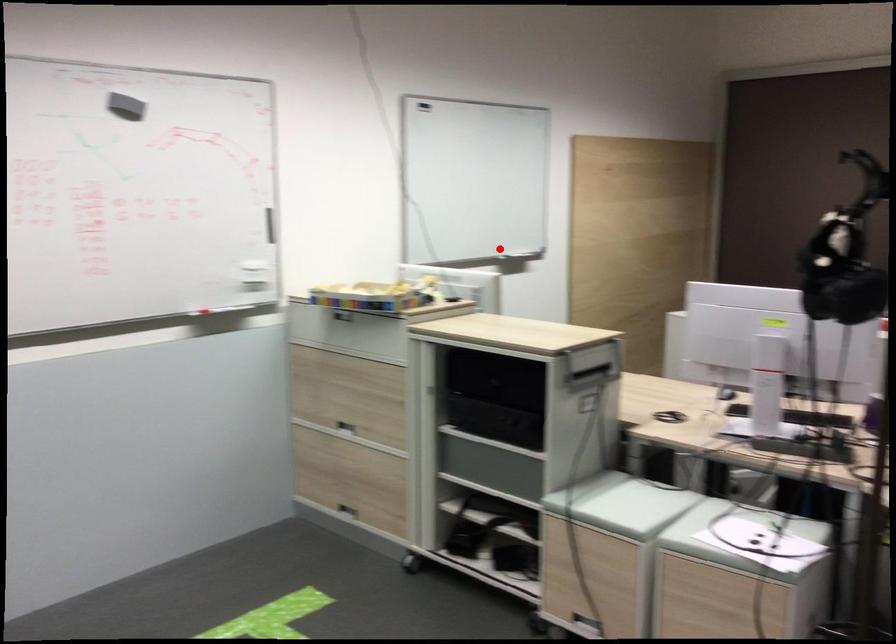
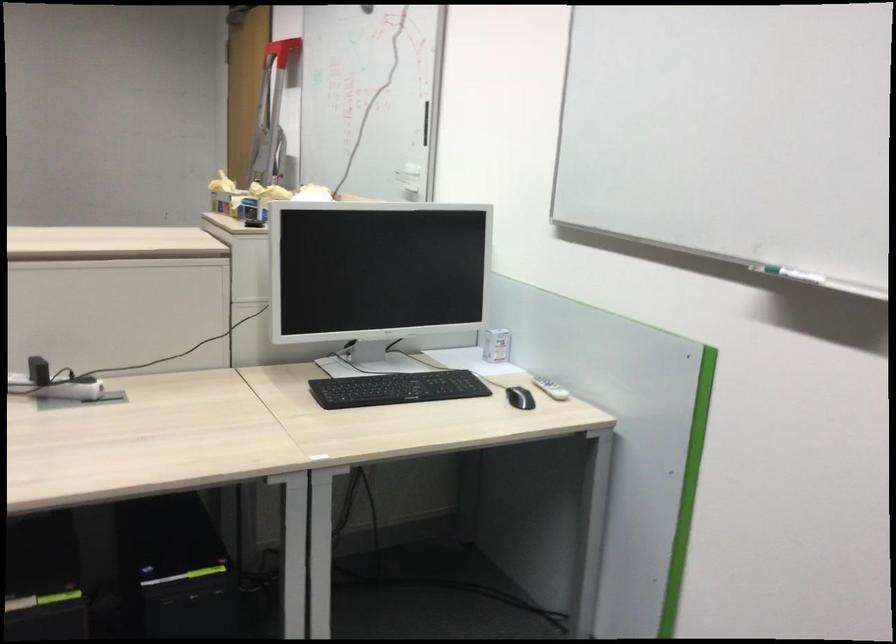
The point at the highlighted location is marked in the first image. Where is the corresponding point in the second image?

(794, 275)